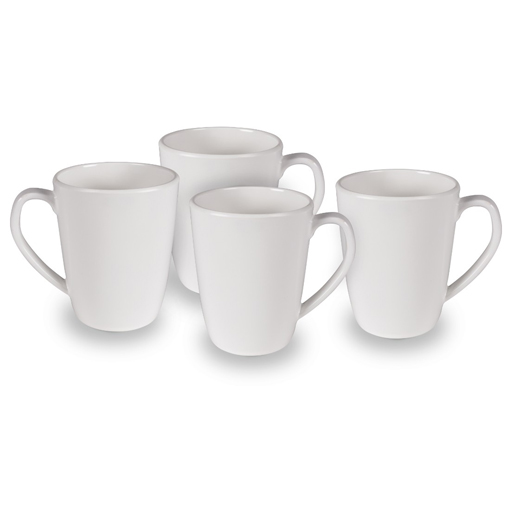
Find the location of a particular element. This screenshot has width=512, height=512. white coffee mug is located at coordinates (385, 250), (251, 270), (123, 241), (227, 136).